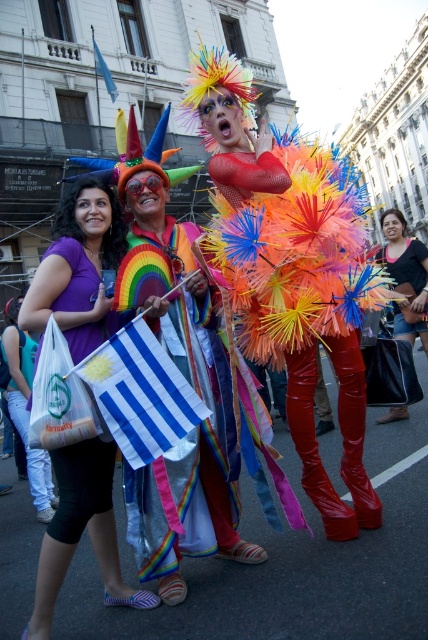
Which is in front, point (145, 461) or point (112, 88)?

Positioned in front is point (145, 461).

Does bluestriped fabricflag at center appear over blue fabric flag at upper left?

No.

Image resolution: width=428 pixels, height=640 pixels. What do you see at coordinates (140, 394) in the screenshot?
I see `bluestriped fabricflag at center` at bounding box center [140, 394].

At what (x,y) coordinates should I click in order to perform the action: click on bluestriped fabricflag at center. Please return your answer as a coordinate pair (x, y). The image size is (428, 640). Looking at the image, I should click on (140, 394).

Between purple matte shirt at center and bluestriped fabricflag at center, which one has more height?

Standing taller between the two is purple matte shirt at center.

Is purple matte shirt at center to the right of bluestriped fabricflag at center from the viewer's perspective?

In fact, purple matte shirt at center is to the left of bluestriped fabricflag at center.

Between point (112, 266) and point (166, 374), which one is positioned behind?

The point (112, 266) is behind.

Where is `purple matte shirt at center`? The width and height of the screenshot is (428, 640). purple matte shirt at center is located at coordinates (79, 269).

Describe the element at coordinates (308, 316) in the screenshot. I see `glossy red boots at center` at that location.

Who is positioned more to the left, glossy red boots at center or purple fabric bag at center?

purple fabric bag at center

Who is more distant from viewer, (232,198) or (83,520)?

Point (232,198)

You are a GUI agent. You are given a task and a screenshot of the screen. Output one action in this format:
    pyautogui.click(x=<x>, y=<y>)
    Task: Click on the glossy red boots at center
    Image resolution: width=428 pixels, height=640 pixels.
    Given the screenshot: What is the action you would take?
    pyautogui.click(x=308, y=316)